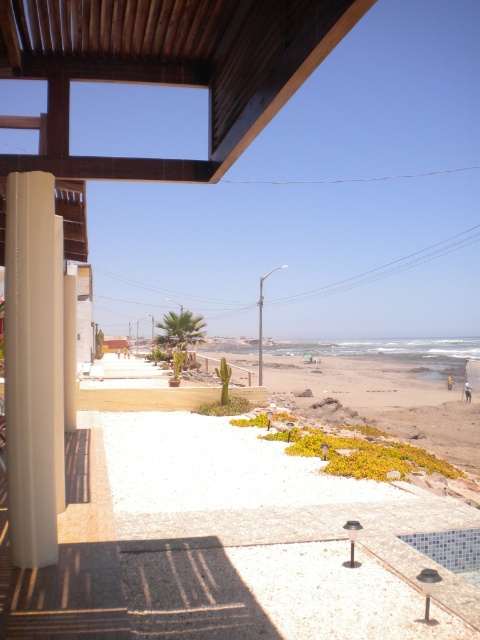
You are designing a garden layout and need to place the green succulent at center and the beige textured balcony at left. Considering their sizes, which object should you allocate more space for?

The green succulent at center has a larger size compared to the beige textured balcony at left, so you should allocate more space for the green succulent at center.

You are standing on the patio and want to walk towards the ocean. Which object, the white glossy pillar at left or the beige textured balcony at left, should you pass by first?

You should pass by the beige textured balcony at left first because the white glossy pillar at left is to the right of the beige textured balcony at left, so the balcony is on the left side closer to your starting position.

You are standing on the patio and want to place a small statue between the white glossy pillar at left and the green succulent at center. Based on their positions, where should the statue be placed?

The white glossy pillar at left is above the green succulent at center, so the statue should be placed below the white glossy pillar at left and above the green succulent at center to be between them.